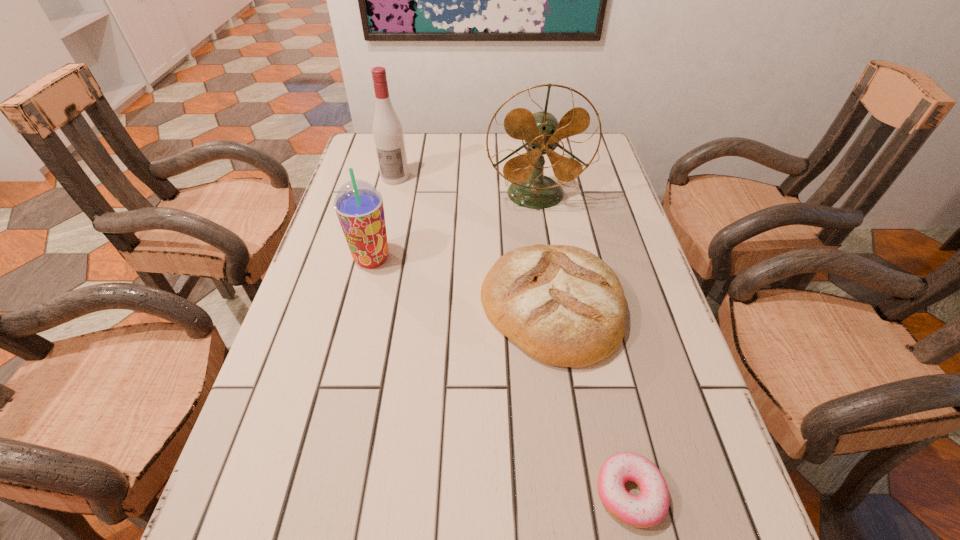
Where is `vacant space that satisfies the following two spatial constraints: 1. on the label of the alcohol; 2. on the right side of the second shortest object`? Image resolution: width=960 pixels, height=540 pixels. vacant space that satisfies the following two spatial constraints: 1. on the label of the alcohol; 2. on the right side of the second shortest object is located at coordinates (364, 307).

This screenshot has width=960, height=540. Identify the location of vacant space that satisfies the following two spatial constraints: 1. in front of the nearest object, directing air flow; 2. on the right side of the fan. (580, 492).